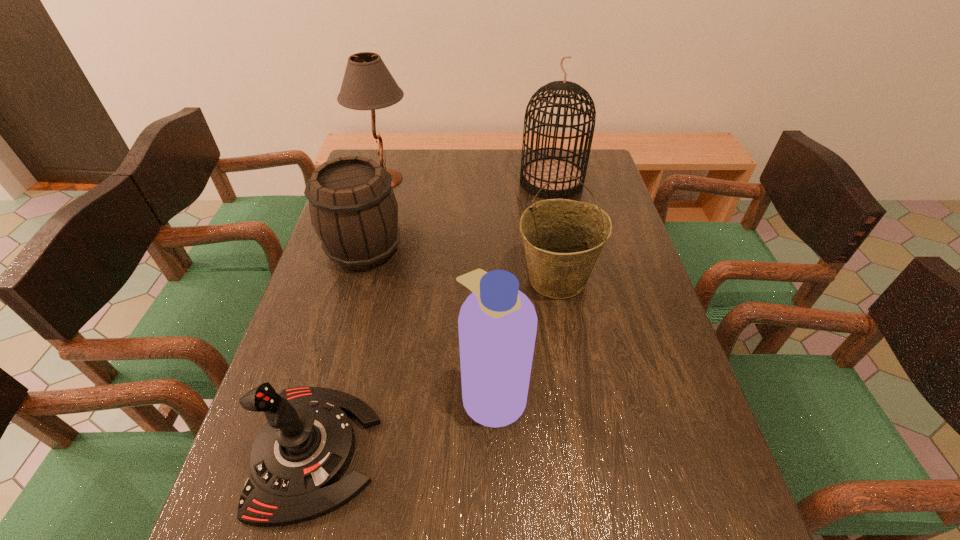
Image resolution: width=960 pixels, height=540 pixels. Identify the location of vacant space that satisfies the following two spatial constraints: 1. on the front side of the shampoo; 2. on the handle side of the shortest object. (494, 451).

Where is `vacant area in the image that satisfies the following two spatial constraints: 1. on the front-facing side of the table lamp; 2. on the back side of the birdcage`? The image size is (960, 540). vacant area in the image that satisfies the following two spatial constraints: 1. on the front-facing side of the table lamp; 2. on the back side of the birdcage is located at coordinates (384, 181).

In order to click on vacant space that satisfies the following two spatial constraints: 1. on the front-facing side of the table lamp; 2. on the right side of the right wine bucket in this screenshot , I will do `click(357, 279)`.